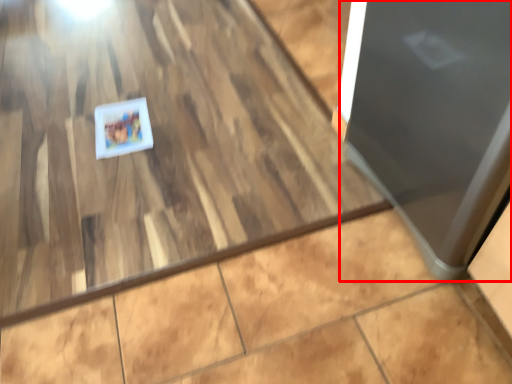
Question: From the image's perspective, what is the correct spatial relationship of door (annotated by the red box) in relation to postcard?

Choices:
 (A) below
 (B) above

Answer: (A)